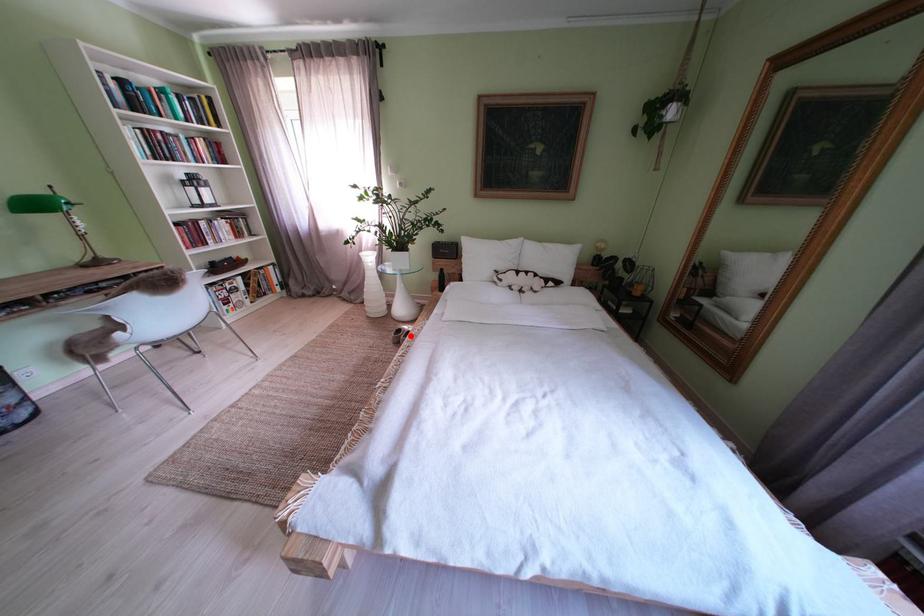
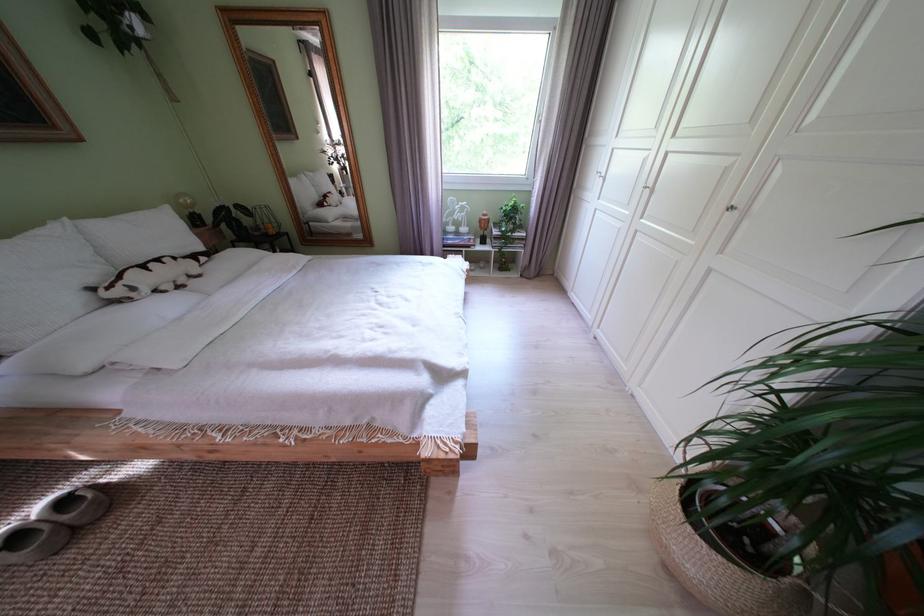
Question: I am providing you with two images of the same scene from different viewpoints. Given a red point in image1, look at the same physical point in image2. Is it:

Choices:
 (A) Closer to the viewpoint
 (B) Farther from the viewpoint

Answer: (A)